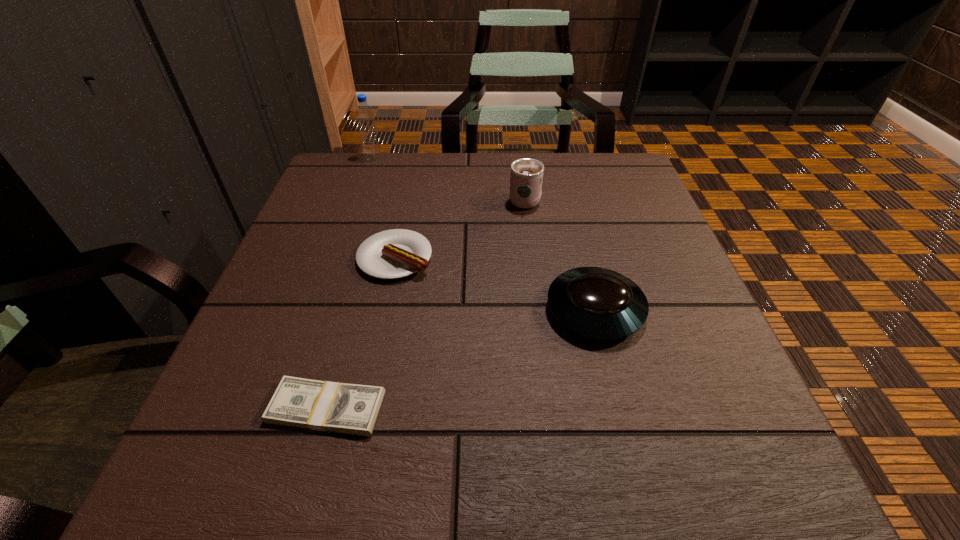
Where is `empty location between the dollar and the cup`? empty location between the dollar and the cup is located at coordinates (425, 303).

This screenshot has width=960, height=540. What are the coordinates of `empty space between the second shortest object and the dollar` in the screenshot? It's located at tap(361, 333).

I want to click on empty space that is in between the farthest object and the second tallest object, so click(448, 179).

You are a GUI agent. You are given a task and a screenshot of the screen. Output one action in this format:
    pyautogui.click(x=<x>, y=<y>)
    Task: Click on the free space between the fourth tallest object and the cup
    
    Given the screenshot: What is the action you would take?
    pyautogui.click(x=460, y=228)

At what (x,y) coordinates should I click in order to perform the action: click on vacant area that lies between the third tallest object and the second shortest object. Please return your answer as a coordinate pair (x, y). The image size is (960, 540). Looking at the image, I should click on (494, 284).

Where is `free spot between the sausage and the cup`? The height and width of the screenshot is (540, 960). free spot between the sausage and the cup is located at coordinates (460, 228).

Find the location of a particular element. free space between the fourth shortest object and the shortest object is located at coordinates (425, 303).

At what (x,y) coordinates should I click in order to perform the action: click on vacant space that's between the second shortest object and the fourth nearest object. Please return your answer as a coordinate pair (x, y). The width and height of the screenshot is (960, 540). Looking at the image, I should click on (460, 228).

Find the location of a particular element. The width and height of the screenshot is (960, 540). object that can be found as the third closest to the third shortest object is located at coordinates (345, 408).

Select which object is the fourth closest to the third shortest object. Please provide its 2D coordinates. Your answer should be formatted as a tuple, i.e. [(x, y)], where the tuple contains the x and y coordinates of a point satisfying the conditions above.

[(364, 114)]